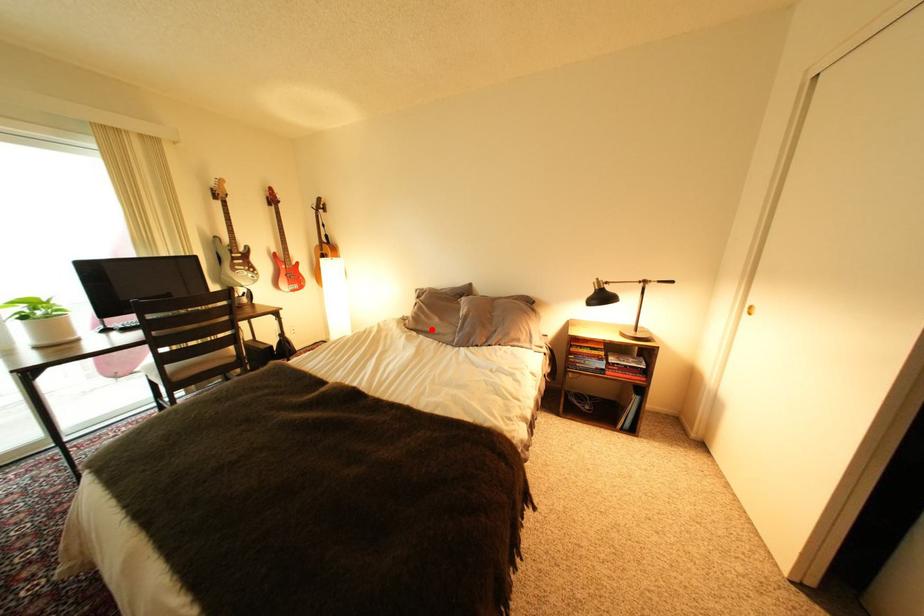
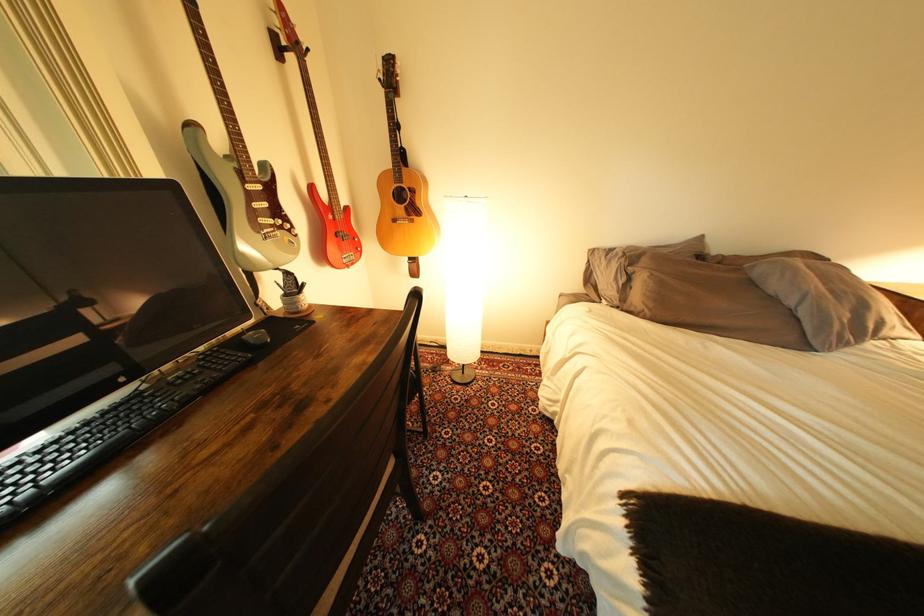
Locate, in the second image, the point that corresponds to the highlighted location in the first image.

(701, 322)